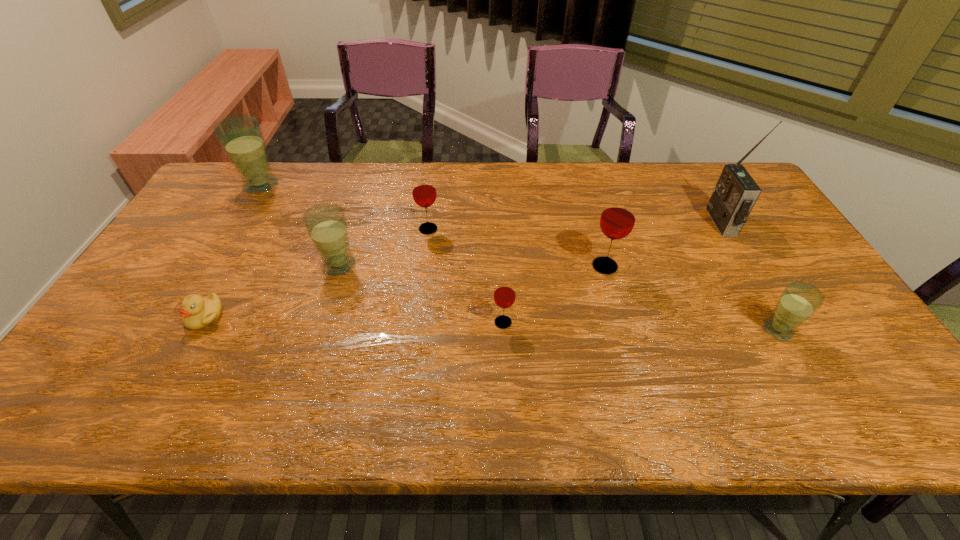
This screenshot has height=540, width=960. In order to click on vacant space that is in between the duckling and the leftmost glass in this screenshot , I will do `click(233, 251)`.

The image size is (960, 540). Identify the location of unoccupied position between the third glass from left to right and the fifth glass from left to right. (516, 248).

Find the location of a particular element. The height and width of the screenshot is (540, 960). free point between the biggest blue glass and the tallest object is located at coordinates (492, 204).

Locate an element on the screen. vacant space in between the farthest red glass and the second red glass from left to right is located at coordinates (466, 276).

Locate an element on the screen. This screenshot has height=540, width=960. object that is the fourth closest one to the nearest blue glass is located at coordinates (424, 193).

This screenshot has height=540, width=960. What are the coordinates of `object that is the third closest to the radio receiver` in the screenshot? It's located at (504, 296).

Find the location of a particular element. This screenshot has width=960, height=540. glass that can be found as the closest to the rightmost glass is located at coordinates (618, 217).

Select which glass appears as the fifth closest to the radio receiver. Please provide its 2D coordinates. Your answer should be formatted as a tuple, i.e. [(x, y)], where the tuple contains the x and y coordinates of a point satisfying the conditions above.

[(326, 224)]

Where is `the closest red glass relative to the nearest blue glass`? The width and height of the screenshot is (960, 540). the closest red glass relative to the nearest blue glass is located at coordinates click(x=618, y=217).

Identify which red glass is the nearest to the tallest object. Please provide its 2D coordinates. Your answer should be formatted as a tuple, i.e. [(x, y)], where the tuple contains the x and y coordinates of a point satisfying the conditions above.

[(618, 217)]